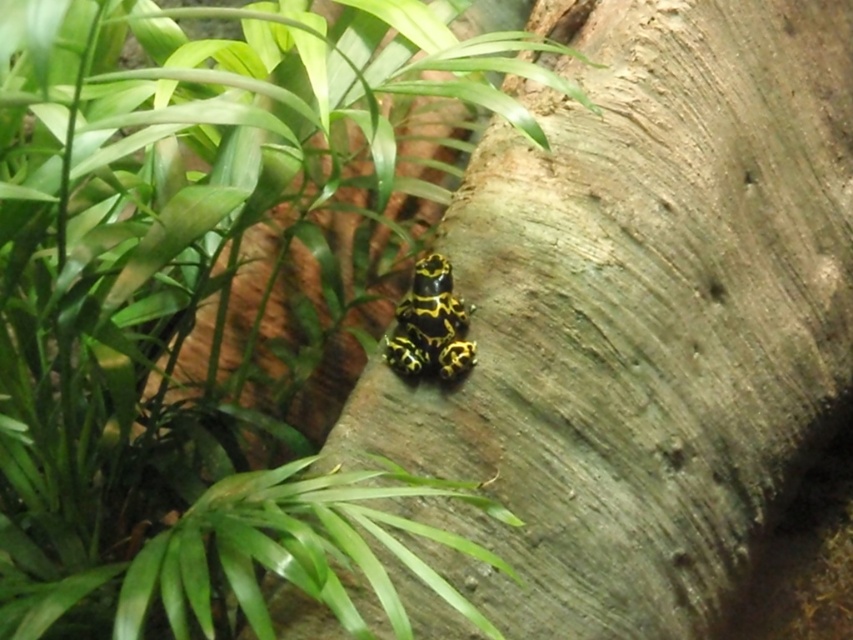
Question: Is smooth brown tree trunk at center positioned at the back of yellow-black spotted frog at center?

Choices:
 (A) yes
 (B) no

Answer: (B)

Question: Among these objects, which one is nearest to the camera?

Choices:
 (A) smooth brown tree trunk at center
 (B) yellow-black spotted frog at center
 (C) green leafy plant at center

Answer: (C)

Question: Does green leafy plant at center have a smaller size compared to yellow-black spotted frog at center?

Choices:
 (A) yes
 (B) no

Answer: (B)

Question: Which of the following is the closest to the observer?

Choices:
 (A) (126, 266)
 (B) (454, 332)
 (C) (292, 625)

Answer: (A)

Question: Can you confirm if green leafy plant at center is positioned above yellow-black spotted frog at center?

Choices:
 (A) yes
 (B) no

Answer: (A)

Question: Among these points, which one is nearest to the camera?

Choices:
 (A) (265, 497)
 (B) (428, 284)

Answer: (A)